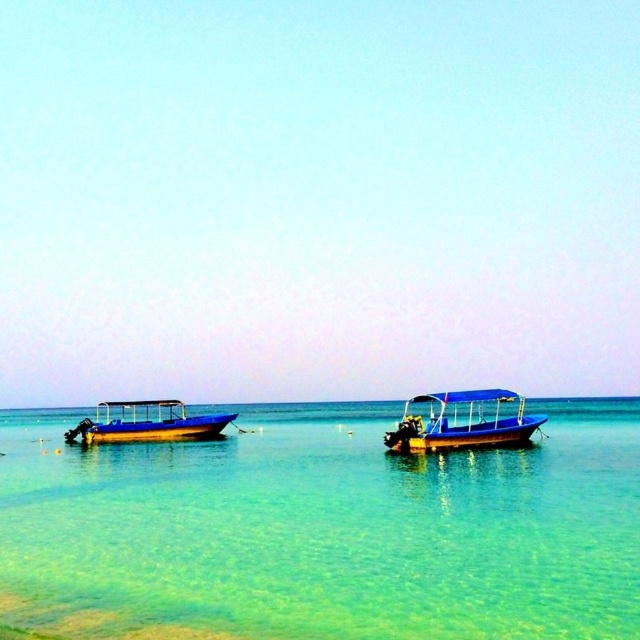
You are planning to take a short trip with a group of friends. You need to choose between the blue plastic boat at center and the blue glossy boat at left. Which boat should you choose if you want the larger one?

The blue glossy boat at left is larger than the blue plastic boat at center, so you should choose the blue glossy boat at left.

You are a photographer planning to capture the blue glossy boat at left and the clear water at center for a magazine spread. To ensure both elements are visible in the frame, where should you position the boat relative to the water?

The clear water at center is positioned on the right side of blue glossy boat at left, so to include both in the frame, position the blue glossy boat at left to the left of the clear water at center.